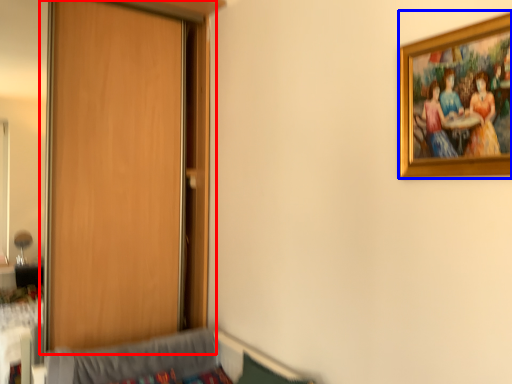
Question: Which object appears farthest to the camera in this image, door (highlighted by a red box) or picture frame (highlighted by a blue box)?

Choices:
 (A) door
 (B) picture frame

Answer: (A)